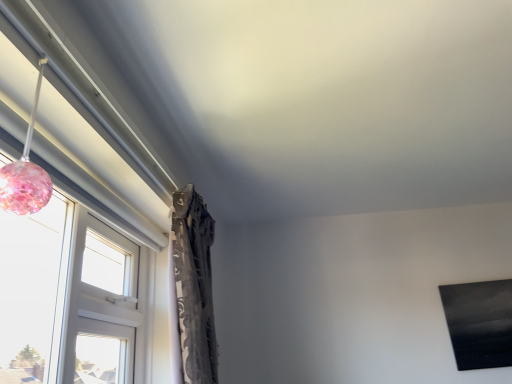
Question: Does transparent glass window at left have a greater height compared to translucent pink glass sphere at left?

Choices:
 (A) yes
 (B) no

Answer: (B)

Question: Does transparent glass window at left have a greater width compared to translucent pink glass sphere at left?

Choices:
 (A) no
 (B) yes

Answer: (A)

Question: Is transparent glass window at left in front of translucent pink glass sphere at left?

Choices:
 (A) no
 (B) yes

Answer: (A)

Question: From the image's perspective, is transparent glass window at left over translucent pink glass sphere at left?

Choices:
 (A) no
 (B) yes

Answer: (A)

Question: Does transparent glass window at left have a lesser height compared to translucent pink glass sphere at left?

Choices:
 (A) yes
 (B) no

Answer: (A)

Question: Is translucent pink glass sphere at left a part of transparent glass window at left?

Choices:
 (A) yes
 (B) no

Answer: (B)

Question: Is translucent pink glass sphere at left shorter than transparent glass window at left?

Choices:
 (A) no
 (B) yes

Answer: (A)

Question: Considering the relative sizes of translucent pink glass sphere at left and transparent glass window at left in the image provided, is translucent pink glass sphere at left wider than transparent glass window at left?

Choices:
 (A) no
 (B) yes

Answer: (B)

Question: Would you consider translucent pink glass sphere at left to be distant from transparent glass window at left?

Choices:
 (A) yes
 (B) no

Answer: (B)

Question: Is translucent pink glass sphere at left further to the viewer compared to transparent glass window at left?

Choices:
 (A) no
 (B) yes

Answer: (A)

Question: From a real-world perspective, is translucent pink glass sphere at left on top of transparent glass window at left?

Choices:
 (A) yes
 (B) no

Answer: (B)

Question: Can you confirm if translucent pink glass sphere at left is smaller than transparent glass window at left?

Choices:
 (A) yes
 (B) no

Answer: (A)

Question: From the image's perspective, is translucent pink glass sphere at left above or below transparent glass window at left?

Choices:
 (A) below
 (B) above

Answer: (B)